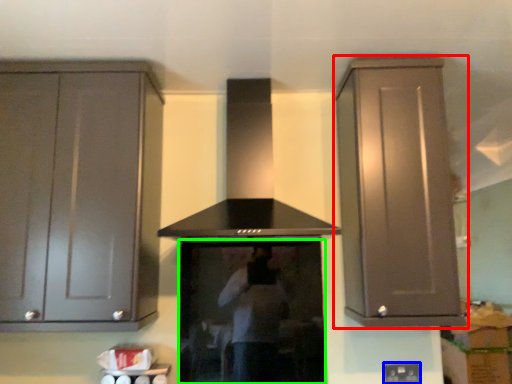
Question: Which object is positioned closest to cabinetry (highlighted by a red box)? Select from electric outlet (highlighted by a blue box) and appliance (highlighted by a green box).

Choices:
 (A) electric outlet
 (B) appliance

Answer: (B)